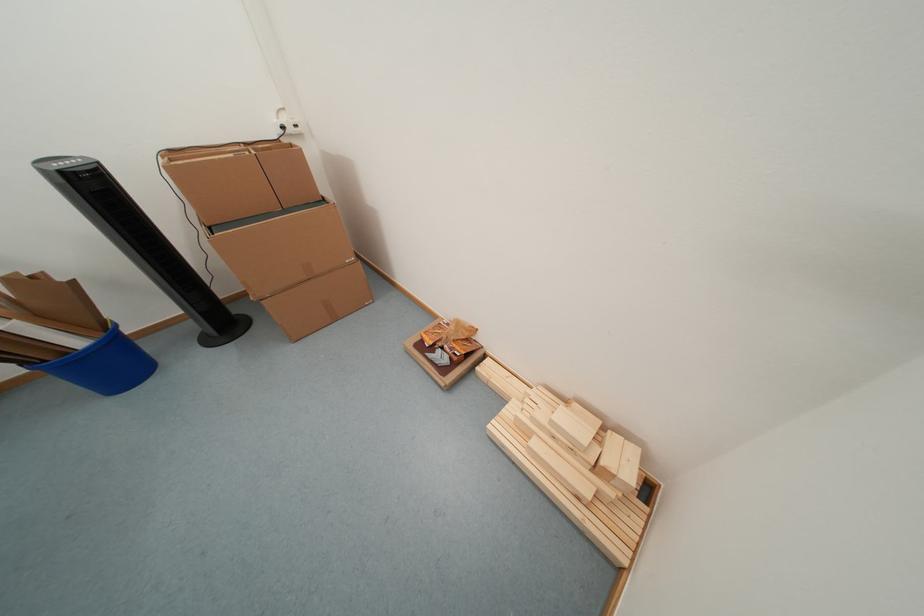
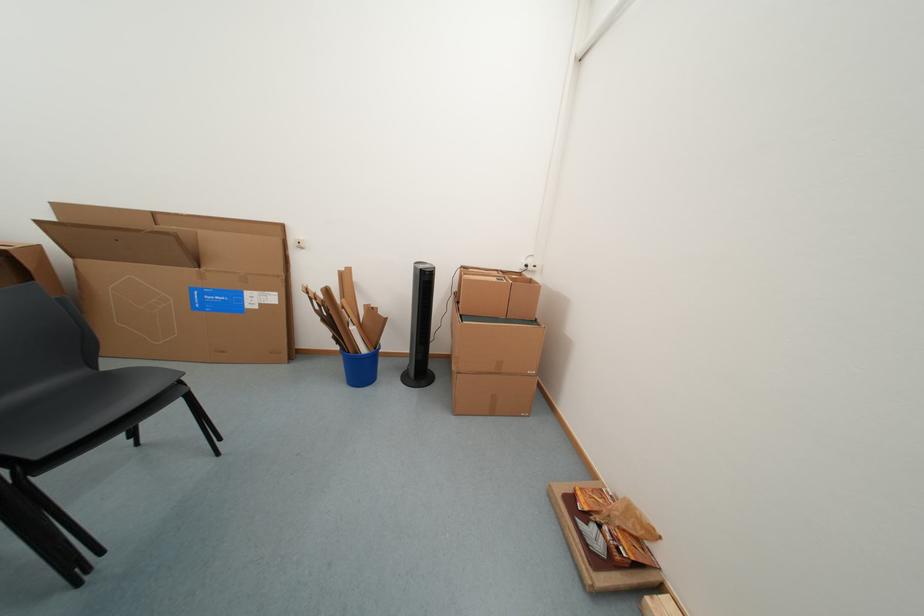
The images are taken continuously from a first-person perspective. In which direction is your viewpoint rotating?

The camera rotated toward left-up.